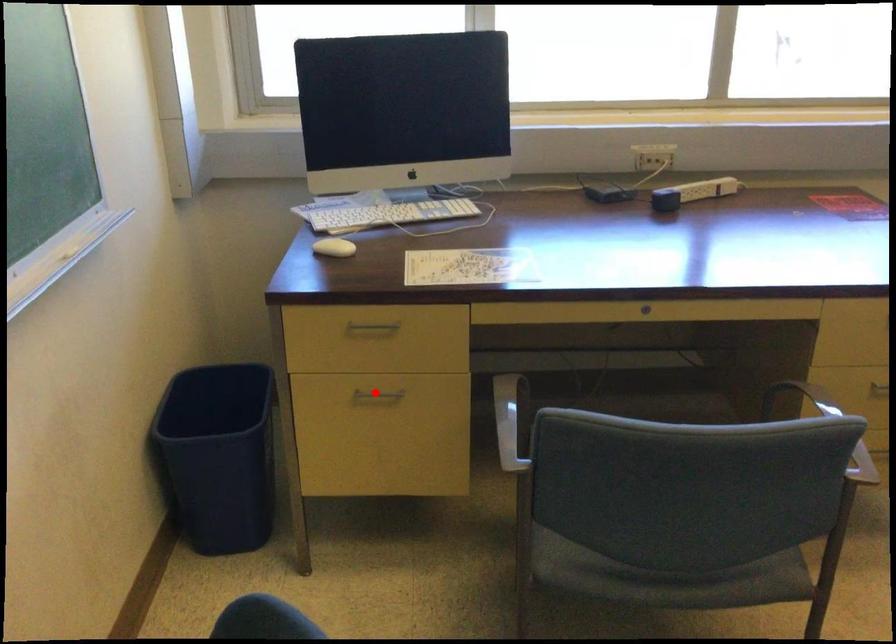
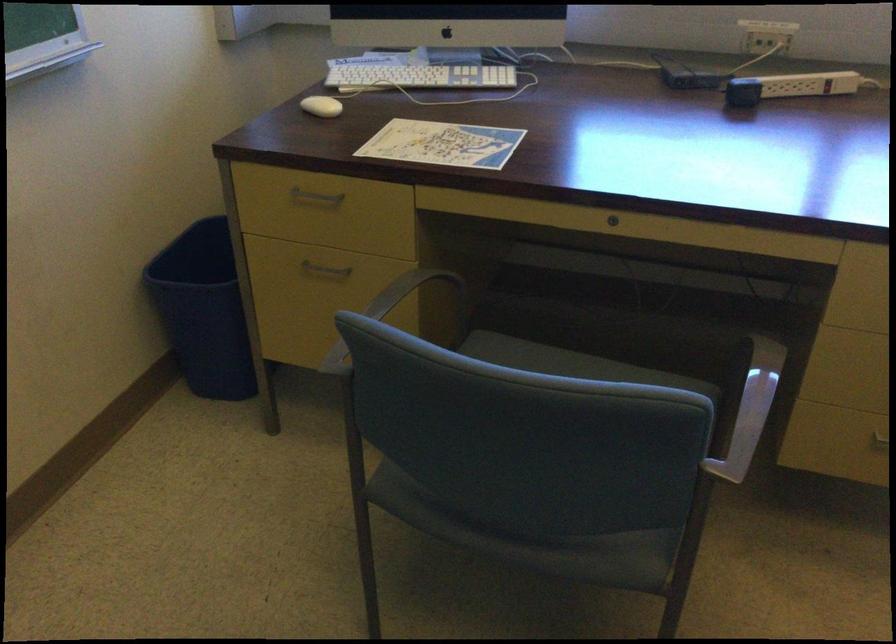
Find the pixel in the second image that matches the highlighted location in the first image.

(324, 269)